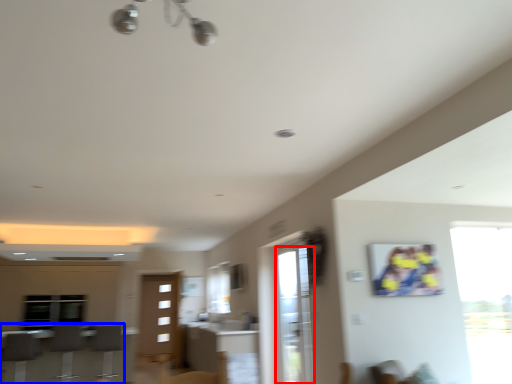
Question: Which object appears farthest to the camera in this image, screen door (highlighted by a red box) or furniture (highlighted by a blue box)?

Choices:
 (A) screen door
 (B) furniture

Answer: (B)